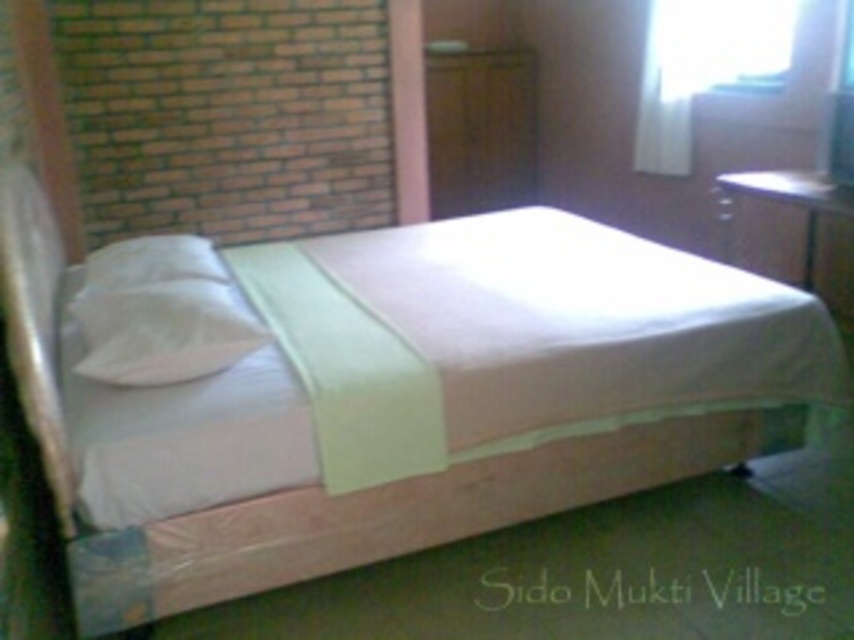
You are trying to make space for a new bookshelf in the bedroom. The white fabric bed at center and the white soft pillow at left are in the way. Which object should you move first if you want to create vertical space above the pillow?

The white fabric bed at center is above the white soft pillow at left, so you should move the white fabric bed at center first to create vertical space above the pillow.

You are standing in the bedroom and want to place a small lamp on the closest object to you between the white fabric bed at center and the white soft pillow at left. Which object should you place it on?

The white fabric bed at center is closer to the viewer than the white soft pillow at left, so you should place the lamp on the white fabric bed at center.

You are trying to decide whether to place a large painting on the wall behind the white fabric bed at center or above the transparent glass window at upper right. Based on their sizes, which location would allow the painting to fit better?

The white fabric bed at center is larger in size than the transparent glass window at upper right, so placing the large painting above the white fabric bed at center would provide a better fit due to the larger space available.